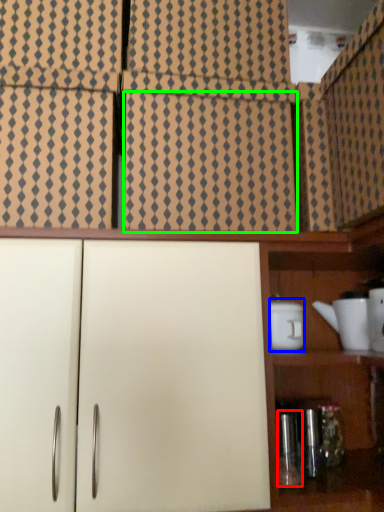
Question: Considering the real-world distances, which object is closest to bottle (highlighted by a red box)? appliance (highlighted by a blue box) or tile (highlighted by a green box).

Choices:
 (A) appliance
 (B) tile

Answer: (A)